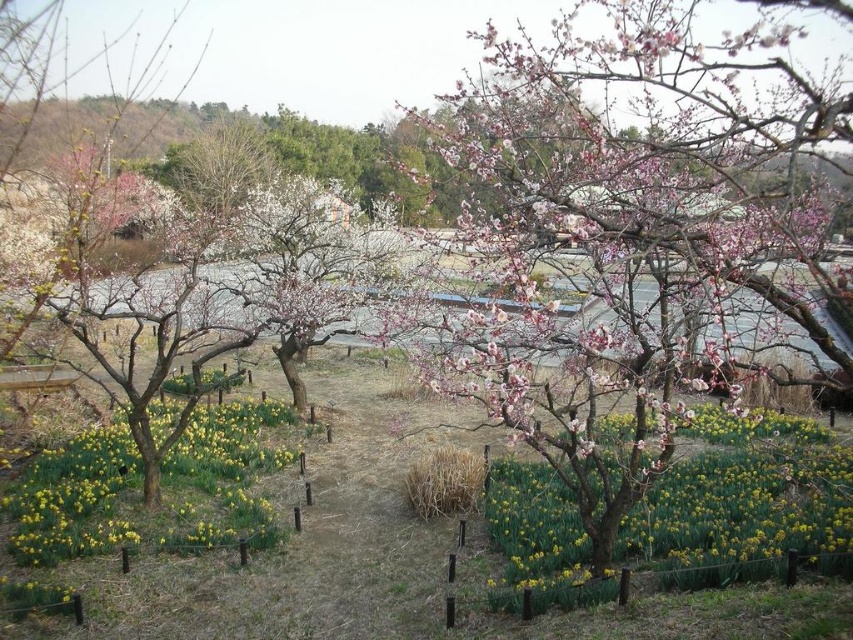
In the scene shown: Does pink bloom tree at center have a greater height compared to pink matte flower at center?

Correct, pink bloom tree at center is much taller as pink matte flower at center.

Does point (515, 161) come farther from viewer compared to point (625, 554)?

No.

The image size is (853, 640). I want to click on pink bloom tree at center, so click(x=627, y=236).

Where is `pink bloom tree at center`? pink bloom tree at center is located at coordinates (627, 236).

Looking at this image, does pink matte flower at center have a greater height compared to yellow matte daffodil at center?

Yes.

Which is behind, point (583, 541) or point (218, 508)?

The point (218, 508) is behind.

Between point (824, 461) and point (230, 464), which one is positioned in front?

Point (824, 461) is more forward.

Where is `pink matte flower at center`? The width and height of the screenshot is (853, 640). pink matte flower at center is located at coordinates (741, 500).

Which is above, pink bloom tree at center or yellow matte daffodil at center?

pink bloom tree at center

Does pink bloom tree at center appear on the left side of yellow matte daffodil at center?

No, pink bloom tree at center is not to the left of yellow matte daffodil at center.

The width and height of the screenshot is (853, 640). Find the location of `pink bloom tree at center`. pink bloom tree at center is located at coordinates (627, 236).